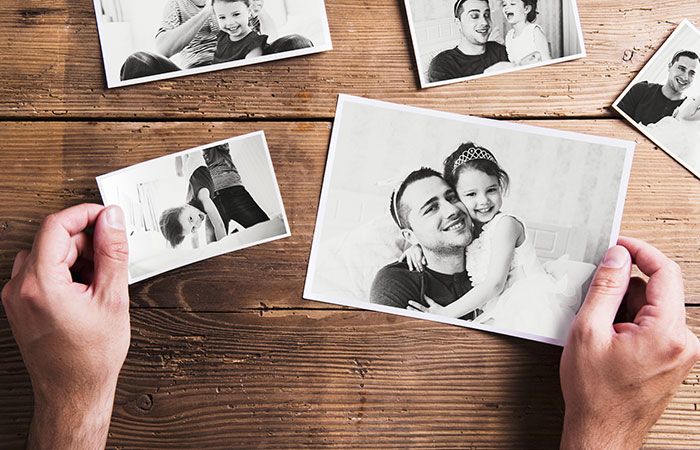
Locate an element on the screen. photos is located at coordinates (220, 248), (242, 36), (476, 44), (679, 95), (490, 208).